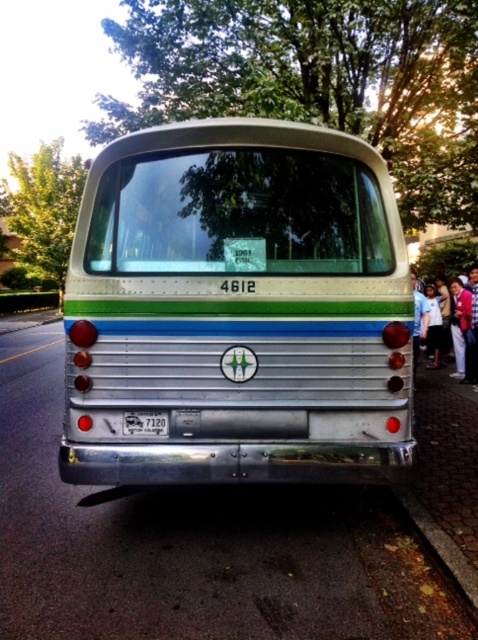
Can you confirm if metallic silver bus at center is wider than white plastic license plate at center?

Yes, metallic silver bus at center is wider than white plastic license plate at center.

Between point (86, 202) and point (166, 433), which one is positioned in front?

Point (166, 433)

What do you see at coordinates (237, 307) in the screenshot? I see `metallic silver bus at center` at bounding box center [237, 307].

You are a GUI agent. You are given a task and a screenshot of the screen. Output one action in this format:
    pyautogui.click(x=<x>, y=<y>)
    Task: Click on the metallic silver bus at center
    The image size is (478, 640).
    Given the screenshot: What is the action you would take?
    pyautogui.click(x=237, y=307)

Can you confirm if metallic silver bus at center is positioned to the right of brown textured curb at lower right?

In fact, metallic silver bus at center is to the left of brown textured curb at lower right.

Can you confirm if metallic silver bus at center is positioned to the left of brown textured curb at lower right?

Indeed, metallic silver bus at center is positioned on the left side of brown textured curb at lower right.

You are a GUI agent. You are given a task and a screenshot of the screen. Output one action in this format:
    pyautogui.click(x=<x>, y=<y>)
    Task: Click on the metallic silver bus at center
    This screenshot has width=478, height=640.
    Given the screenshot: What is the action you would take?
    pyautogui.click(x=237, y=307)

Which is above, brown textured curb at lower right or matte pink clothing at right?

matte pink clothing at right

Does brown textured curb at lower right have a larger size compared to matte pink clothing at right?

Incorrect, brown textured curb at lower right is not larger than matte pink clothing at right.

In order to click on brown textured curb at lower right in this screenshot , I will do `click(442, 552)`.

Locate an element on the screen. brown textured curb at lower right is located at coordinates (442, 552).